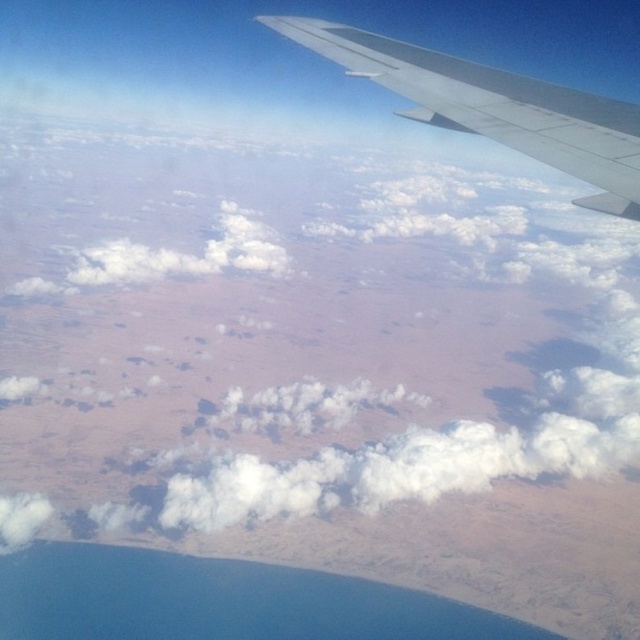
Is point (396, 392) less distant than point (128, 620)?

No, (396, 392) is further to viewer.

Between white fluffy cloud at upper center and blue liquid water at bottom, which one appears on the right side from the viewer's perspective?

white fluffy cloud at upper center

Image resolution: width=640 pixels, height=640 pixels. What do you see at coordinates (292, 328) in the screenshot? I see `white fluffy cloud at upper center` at bounding box center [292, 328].

You are a GUI agent. You are given a task and a screenshot of the screen. Output one action in this format:
    pyautogui.click(x=<x>, y=<y>)
    Task: Click on the white fluffy cloud at upper center
    
    Given the screenshot: What is the action you would take?
    pyautogui.click(x=292, y=328)

Is white fluffy cloud at upper center above smooth gray wing at upper right?

Actually, white fluffy cloud at upper center is below smooth gray wing at upper right.

Which is more to the right, white fluffy cloud at upper center or smooth gray wing at upper right?

smooth gray wing at upper right

Between point (330, 260) and point (465, 67), which one is positioned in front?

Point (465, 67) is more forward.

Find the location of a particular element. Image resolution: width=640 pixels, height=640 pixels. white fluffy cloud at upper center is located at coordinates (292, 328).

Can you confirm if blue liquid water at bottom is bigger than smooth gray wing at upper right?

Yes, blue liquid water at bottom is bigger than smooth gray wing at upper right.

Is blue liquid water at bottom smaller than smooth gray wing at upper right?

No.

The width and height of the screenshot is (640, 640). Describe the element at coordinates (218, 600) in the screenshot. I see `blue liquid water at bottom` at that location.

Where is `blue liquid water at bottom`? This screenshot has height=640, width=640. blue liquid water at bottom is located at coordinates (218, 600).